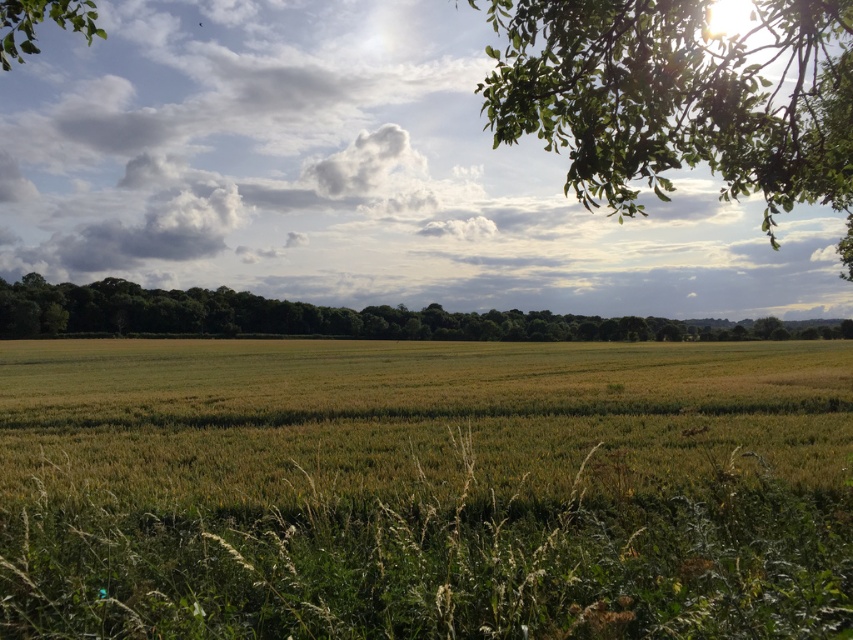
Question: Does green leafy tree at upper right appear over green leafy trees at center?

Choices:
 (A) yes
 (B) no

Answer: (A)

Question: Which point is farther to the camera?

Choices:
 (A) (598, 45)
 (B) (132, 474)

Answer: (B)

Question: Is green leafy tree at upper right to the left of green leafy tree at upper left from the viewer's perspective?

Choices:
 (A) yes
 (B) no

Answer: (B)

Question: Which point is closer to the camera taking this photo?

Choices:
 (A) (85, 3)
 (B) (22, 284)
 (C) (631, 141)
 (D) (20, 440)

Answer: (C)

Question: Can you confirm if green leafy trees at center is positioned above green leafy tree at upper left?

Choices:
 (A) yes
 (B) no

Answer: (B)

Question: Which point is farther to the camera?

Choices:
 (A) green leafy tree at upper right
 (B) green leafy trees at center

Answer: (B)